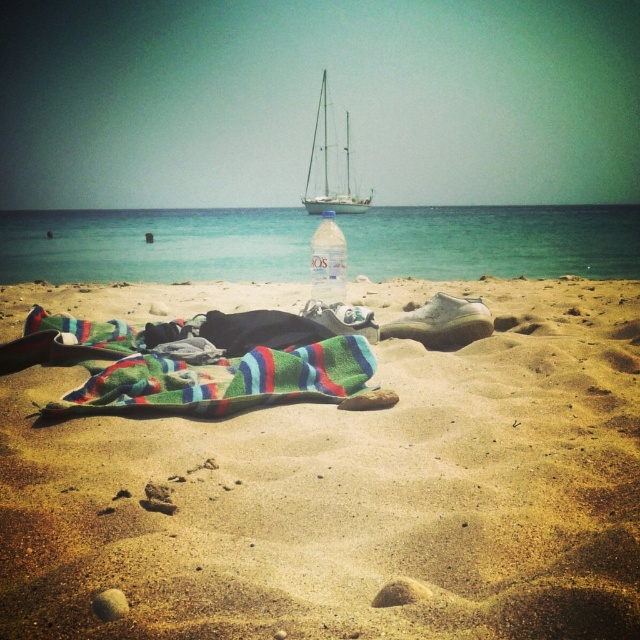
Question: Does clear blue water at center appear on the left side of striped cotton towel at center?

Choices:
 (A) yes
 (B) no

Answer: (A)

Question: Which point appears farthest from the camera in this image?

Choices:
 (A) (346, 116)
 (B) (195, 374)
 (C) (324, 244)
 (D) (252, 566)

Answer: (A)

Question: Is clear blue water at center in front of clear plastic bottle at center?

Choices:
 (A) yes
 (B) no

Answer: (B)

Question: Which of these objects is positioned closest to the smooth golden sand at center?

Choices:
 (A) striped cotton towel at center
 (B) clear blue water at center

Answer: (A)

Question: Is clear blue water at center further to camera compared to clear plastic bottle at center?

Choices:
 (A) no
 (B) yes

Answer: (B)

Question: Considering the real-world distances, which object is closest to the clear plastic bottle at center?

Choices:
 (A) clear blue water at center
 (B) striped cotton towel at center
 (C) smooth golden sand at center

Answer: (B)